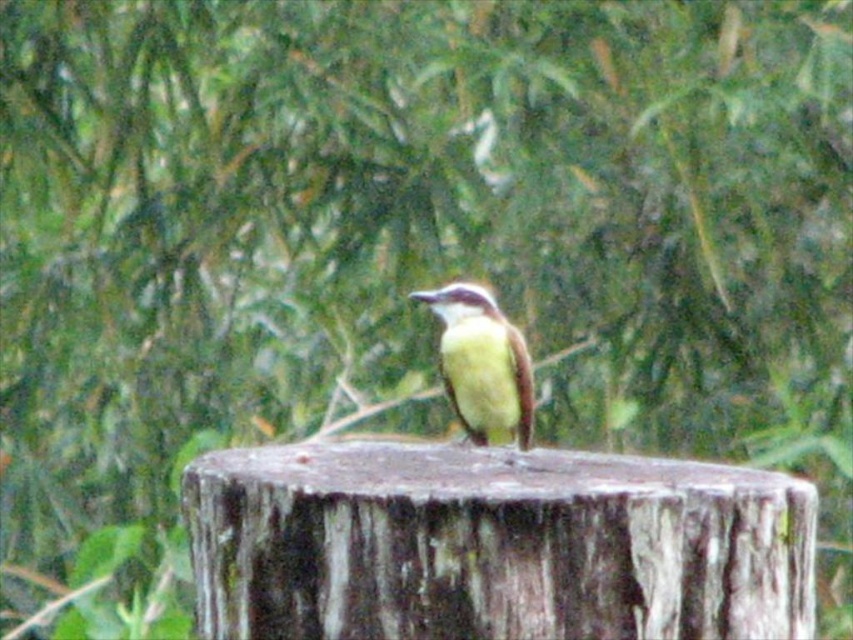
Question: Which point is farther to the camera?

Choices:
 (A) (567, 580)
 (B) (520, 376)

Answer: (B)

Question: Which object appears closest to the camera in this image?

Choices:
 (A) rough bark stump at center
 (B) yellow matte bird at center

Answer: (A)

Question: Among these points, which one is farthest from the camera?

Choices:
 (A) tap(490, 396)
 (B) tap(489, 636)

Answer: (A)

Question: Is rough bark stump at center to the left of yellow matte bird at center from the viewer's perspective?

Choices:
 (A) yes
 (B) no

Answer: (A)

Question: Considering the relative positions of rough bark stump at center and yellow matte bird at center in the image provided, where is rough bark stump at center located with respect to yellow matte bird at center?

Choices:
 (A) left
 (B) right

Answer: (A)

Question: Does rough bark stump at center have a lesser width compared to yellow matte bird at center?

Choices:
 (A) no
 (B) yes

Answer: (A)